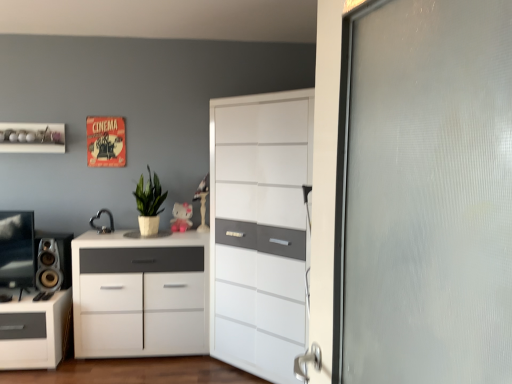
Where is `white matte cabinet at center, the 2th chest of drawers viewed from the right`? This screenshot has height=384, width=512. white matte cabinet at center, the 2th chest of drawers viewed from the right is located at coordinates (140, 294).

The height and width of the screenshot is (384, 512). What do you see at coordinates (149, 196) in the screenshot? I see `green matte plant at center` at bounding box center [149, 196].

Find the location of `green matte plant at center`. green matte plant at center is located at coordinates coord(149,196).

The image size is (512, 384). Identify the location of matte pink plastic toy at center. (181, 217).

What do you see at coordinates (259, 230) in the screenshot? This screenshot has height=384, width=512. I see `white glossy cabinet at center, which is counted as the 1th chest of drawers, starting from the right` at bounding box center [259, 230].

Where is `matte black speaker at left`? matte black speaker at left is located at coordinates (53, 261).

Locate an element on the screen. This screenshot has width=512, height=384. white matte cabinet at center, the first chest of drawers when ordered from left to right is located at coordinates click(x=140, y=294).

Is the position of white matte cabinet at center, the 2th chest of drawers viewed from the right, more distant than that of matte black speaker at left?

No, white matte cabinet at center, the 2th chest of drawers viewed from the right, is closer to the viewer.

Is white matte cabinet at center, the first chest of drawers when ordered from left to right, not within matte black speaker at left?

Indeed, white matte cabinet at center, the first chest of drawers when ordered from left to right, is completely outside matte black speaker at left.

Which of these two, white matte cabinet at center, the first chest of drawers when ordered from left to right, or matte black speaker at left, stands shorter?

With less height is matte black speaker at left.

Between point (156, 175) and point (68, 256), which one is positioned behind?

Point (156, 175)

Would you say green matte plant at center is to the left or to the right of matte black speaker at left in the picture?

In the image, green matte plant at center appears on the right side of matte black speaker at left.

Is green matte plant at center placed right next to matte black speaker at left?

green matte plant at center is not next to matte black speaker at left, and they're not touching.

Considering the sizes of objects green matte plant at center and matte black speaker at left in the image provided, who is shorter, green matte plant at center or matte black speaker at left?

matte black speaker at left is shorter.

Is white matte cabinet at center, the first chest of drawers when ordered from left to right, at the back of matte black speaker at left?

No, matte black speaker at left is not facing the opposite direction of white matte cabinet at center, the first chest of drawers when ordered from left to right.

Between point (53, 283) and point (157, 289), which one is positioned behind?

The point (157, 289) is more distant.

From a real-world perspective, which object stands above the other?

In real-world perspective, matte black speaker at left is above.

From a real-world perspective, between white glossy cabinet at center, which is counted as the 1th chest of drawers, starting from the right, and matte black speaker at left, who is vertically lower?

In real-world perspective, matte black speaker at left is lower.

From the image's perspective, which one is positioned lower, white glossy cabinet at center, which is counted as the 1th chest of drawers, starting from the right, or matte black speaker at left?

matte black speaker at left is shown below in the image.

How many degrees apart are the facing directions of white glossy cabinet at center, the second chest of drawers positioned from the left, and matte black speaker at left?

The facing directions of white glossy cabinet at center, the second chest of drawers positioned from the left, and matte black speaker at left are 0.11 degrees apart.

From the picture: How different are the orientations of white matte cabinet at center, the 2th chest of drawers viewed from the right, and metallic heart-shaped object at center in degrees?

0.000161 degrees separate the facing orientations of white matte cabinet at center, the 2th chest of drawers viewed from the right, and metallic heart-shaped object at center.

Is white matte cabinet at center, the first chest of drawers when ordered from left to right, oriented away from metallic heart-shaped object at center?

No.

Considering the sizes of white matte cabinet at center, the first chest of drawers when ordered from left to right, and metallic heart-shaped object at center in the image, is white matte cabinet at center, the first chest of drawers when ordered from left to right, taller or shorter than metallic heart-shaped object at center?

In the image, white matte cabinet at center, the first chest of drawers when ordered from left to right, appears to be taller than metallic heart-shaped object at center.

From a real-world perspective, which object rests below the other?

white matte cabinet at center, the 2th chest of drawers viewed from the right.

Is white matte cabinet at center, the first chest of drawers when ordered from left to right, aimed at white glossy cabinet at center, which is counted as the 1th chest of drawers, starting from the right?

No, white matte cabinet at center, the first chest of drawers when ordered from left to right, is not turned towards white glossy cabinet at center, which is counted as the 1th chest of drawers, starting from the right.

Considering the relative sizes of white matte cabinet at center, the 2th chest of drawers viewed from the right, and white glossy cabinet at center, which is counted as the 1th chest of drawers, starting from the right, in the image provided, is white matte cabinet at center, the 2th chest of drawers viewed from the right, wider than white glossy cabinet at center, which is counted as the 1th chest of drawers, starting from the right,?

No.

From a real-world perspective, is white matte cabinet at center, the 2th chest of drawers viewed from the right, under white glossy cabinet at center, which is counted as the 1th chest of drawers, starting from the right?

Yes, from a real-world perspective, white matte cabinet at center, the 2th chest of drawers viewed from the right, is below white glossy cabinet at center, which is counted as the 1th chest of drawers, starting from the right.

In the image, there is a white glossy cabinet at center, which is counted as the 1th chest of drawers, starting from the right. Where is `the chest of drawers below it (from the image's perspective)`? The width and height of the screenshot is (512, 384). the chest of drawers below it (from the image's perspective) is located at coordinates (140, 294).

Visually, is matte pink plastic toy at center positioned to the left or to the right of metallic heart-shaped object at center?

matte pink plastic toy at center is positioned on metallic heart-shaped object at center's right side.

Is matte pink plastic toy at center not inside metallic heart-shaped object at center?

Absolutely, matte pink plastic toy at center is external to metallic heart-shaped object at center.

Can you confirm if matte pink plastic toy at center is bigger than metallic heart-shaped object at center?

Indeed, matte pink plastic toy at center has a larger size compared to metallic heart-shaped object at center.

Identify the location of speaker that appears above the white matte cabinet at center, the first chest of drawers when ordered from left to right (from a real-world perspective). This screenshot has height=384, width=512. (53, 261).

Where is `speaker on the left of green matte plant at center`? The image size is (512, 384). speaker on the left of green matte plant at center is located at coordinates (53, 261).

Looking at the image, which one is located closer to white matte cabinet at center, the first chest of drawers when ordered from left to right, white glossy cabinet at center, which is counted as the 1th chest of drawers, starting from the right, or matte black speaker at left?

matte black speaker at left.

When comparing their distances from matte pink plastic toy at center, does matte black speaker at left or white glossy cabinet at center, which is counted as the 1th chest of drawers, starting from the right, seem further?

Among the two, matte black speaker at left is located further to matte pink plastic toy at center.

When comparing their distances from matte pink plastic toy at center, does green matte plant at center or white matte cabinet at center, the 2th chest of drawers viewed from the right, seem further?

white matte cabinet at center, the 2th chest of drawers viewed from the right, lies further to matte pink plastic toy at center than the other object.

When comparing their distances from green matte plant at center, does matte pink plastic toy at center or white glossy cabinet at center, the second chest of drawers positioned from the left, seem further?

Based on the image, white glossy cabinet at center, the second chest of drawers positioned from the left, appears to be further to green matte plant at center.

Considering their positions, is metallic heart-shaped object at center positioned closer to matte black speaker at left than matte pink plastic toy at center?

metallic heart-shaped object at center lies closer to matte black speaker at left than the other object.

From the image, which object appears to be farther from white glossy cabinet at center, the second chest of drawers positioned from the left, green matte plant at center or metallic heart-shaped object at center?

Based on the image, metallic heart-shaped object at center appears to be further to white glossy cabinet at center, the second chest of drawers positioned from the left.

Looking at the image, which one is located closer to white glossy shelf at upper left, matte pink plastic toy at center or white matte cabinet at center, the 2th chest of drawers viewed from the right?

Among the two, matte pink plastic toy at center is located nearer to white glossy shelf at upper left.

Considering their positions, is metallic heart-shaped object at center positioned closer to green matte plant at center than matte black speaker at left?

Among the two, metallic heart-shaped object at center is located nearer to green matte plant at center.

Identify the location of plant between metallic heart-shaped object at center and matte pink plastic toy at center from left to right. This screenshot has width=512, height=384. [149, 196].

This screenshot has height=384, width=512. I want to click on toy located between white glossy shelf at upper left and white glossy cabinet at center, the second chest of drawers positioned from the left, in the left-right direction, so click(181, 217).

At what (x,y) coordinates should I click in order to perform the action: click on plant between white glossy shelf at upper left and white glossy cabinet at center, the second chest of drawers positioned from the left, from left to right. Please return your answer as a coordinate pair (x, y). The width and height of the screenshot is (512, 384). Looking at the image, I should click on [x=149, y=196].

Where is `chest of drawers between matte black speaker at left and white glossy cabinet at center, which is counted as the 1th chest of drawers, starting from the right`? The image size is (512, 384). chest of drawers between matte black speaker at left and white glossy cabinet at center, which is counted as the 1th chest of drawers, starting from the right is located at coordinates (140, 294).